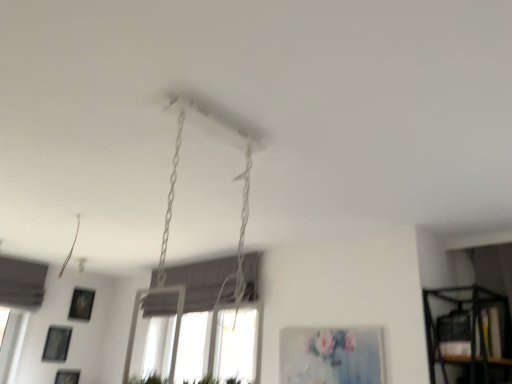
Question: Would you say matte blue canvas at center, arranged as the first picture frame when viewed from the top, is outside matte black picture frame at lower left, which is counted as the 3th picture frame, starting from the front?

Choices:
 (A) no
 (B) yes

Answer: (B)

Question: Does matte blue canvas at center, which is the fourth picture frame from back to front, have a greater height compared to matte black picture frame at lower left, which ranks as the first picture frame in left-to-right order?

Choices:
 (A) no
 (B) yes

Answer: (B)

Question: Can you confirm if matte blue canvas at center, acting as the fourth picture frame starting from the bottom, is positioned to the right of matte black picture frame at lower left, the third picture frame viewed from the top?

Choices:
 (A) yes
 (B) no

Answer: (A)

Question: Is matte blue canvas at center, which is the first picture frame from front to back, oriented away from matte black picture frame at lower left, arranged as the 4th picture frame when viewed from the right?

Choices:
 (A) yes
 (B) no

Answer: (B)

Question: From a real-world perspective, is matte blue canvas at center, arranged as the first picture frame when viewed from the top, located beneath matte black picture frame at lower left, arranged as the 4th picture frame when viewed from the right?

Choices:
 (A) yes
 (B) no

Answer: (A)

Question: Could matte black picture frame at lower left, which ranks as the first picture frame in left-to-right order, be considered to be inside matte blue canvas at center, which is the first picture frame from front to back?

Choices:
 (A) yes
 (B) no

Answer: (B)

Question: Does black plastic shelf at lower right have a greater height compared to matte blue canvas at center, placed as the fourth picture frame when sorted from left to right?

Choices:
 (A) yes
 (B) no

Answer: (B)

Question: Could matte blue canvas at center, placed as the fourth picture frame when sorted from left to right, be considered to be inside black plastic shelf at lower right?

Choices:
 (A) yes
 (B) no

Answer: (B)

Question: Can you confirm if black plastic shelf at lower right is positioned to the right of matte blue canvas at center, which is the first picture frame from front to back?

Choices:
 (A) yes
 (B) no

Answer: (A)

Question: Is the position of black plastic shelf at lower right more distant than that of matte blue canvas at center, arranged as the first picture frame when viewed from the top?

Choices:
 (A) yes
 (B) no

Answer: (B)

Question: Is black plastic shelf at lower right oriented towards matte blue canvas at center, acting as the fourth picture frame starting from the bottom?

Choices:
 (A) no
 (B) yes

Answer: (A)

Question: Is black plastic shelf at lower right positioned beyond the bounds of matte blue canvas at center, placed as the fourth picture frame when sorted from left to right?

Choices:
 (A) yes
 (B) no

Answer: (A)

Question: From the image's perspective, would you say matte black picture frame at lower left, acting as the third picture frame starting from the bottom, is positioned over matte black picture frame at lower left, which ranks as the first picture frame in left-to-right order?

Choices:
 (A) yes
 (B) no

Answer: (A)